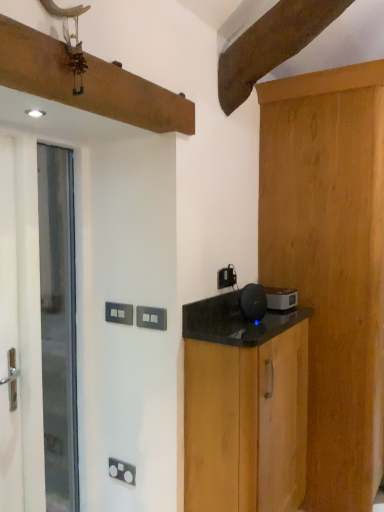
In order to face white glossy door at left, should I rotate leftwards or rightwards?

To face it directly, rotate left by 17.857 degrees.

The width and height of the screenshot is (384, 512). What do you see at coordinates (331, 263) in the screenshot?
I see `light brown wood cabinet at right, marked as the second cabinetry in a left-to-right arrangement` at bounding box center [331, 263].

Measure the distance between point [9,186] and camera.

A distance of 1.55 meters exists between point [9,186] and camera.

Measure the distance between point (x=253, y=312) and camera.

Point (x=253, y=312) is 2.08 meters from camera.

Image resolution: width=384 pixels, height=512 pixels. What do you see at coordinates (119, 313) in the screenshot? I see `white plastic switch at center, the second electric outlet from the top` at bounding box center [119, 313].

The width and height of the screenshot is (384, 512). What are the coordinates of `satin black speaker at right, positioned as the first appliance in right-to-left order` in the screenshot? It's located at (281, 298).

Where is `white glossy door at left`? white glossy door at left is located at coordinates (58, 325).

Which of these two, light brown wood cabinet at right, positioned as the 1th cabinetry in right-to-left order, or black plastic electric outlet at upper center, the 1th electric outlet from the top, stands shorter?

black plastic electric outlet at upper center, the 1th electric outlet from the top, is shorter.

From the image's perspective, is light brown wood cabinet at right, positioned as the 1th cabinetry in right-to-left order, on black plastic electric outlet at upper center, the 3th electric outlet viewed from the front?

No, from the image's perspective, light brown wood cabinet at right, positioned as the 1th cabinetry in right-to-left order, is not above black plastic electric outlet at upper center, the 3th electric outlet viewed from the front.

Would you say light brown wood cabinet at right, marked as the second cabinetry in a left-to-right arrangement, contains black plastic electric outlet at upper center, the 3th electric outlet viewed from the front?

That's incorrect, black plastic electric outlet at upper center, the 3th electric outlet viewed from the front, is not inside light brown wood cabinet at right, marked as the second cabinetry in a left-to-right arrangement.

Between light brown wood cabinet at right, positioned as the 1th cabinetry in right-to-left order, and black plastic electric outlet at upper center, the 3th electric outlet viewed from the front, which one is positioned in front?

Positioned in front is light brown wood cabinet at right, positioned as the 1th cabinetry in right-to-left order.

Does black wood cabinet at right, which is the 1th cabinetry in left-to-right order, have a smaller size compared to white matte screen door at left?

Incorrect, black wood cabinet at right, which is the 1th cabinetry in left-to-right order, is not smaller in size than white matte screen door at left.

In the scene shown: Which object is wider, black wood cabinet at right, marked as the 2th cabinetry in a right-to-left arrangement, or white matte screen door at left?

black wood cabinet at right, marked as the 2th cabinetry in a right-to-left arrangement.

Is black wood cabinet at right, which is the 1th cabinetry in left-to-right order, at the right side of white matte screen door at left?

Indeed, black wood cabinet at right, which is the 1th cabinetry in left-to-right order, is positioned on the right side of white matte screen door at left.

How much distance is there between black wood cabinet at right, which is the 1th cabinetry in left-to-right order, and white matte screen door at left?

black wood cabinet at right, which is the 1th cabinetry in left-to-right order, and white matte screen door at left are 80.73 centimeters apart from each other.

Is there a large distance between black plastic speaker at center, the 1th appliance viewed from the front, and light brown wood cabinet at right, positioned as the 1th cabinetry in right-to-left order?

black plastic speaker at center, the 1th appliance viewed from the front, is actually quite close to light brown wood cabinet at right, positioned as the 1th cabinetry in right-to-left order.

Identify the location of the 1st appliance below the light brown wood cabinet at right, marked as the second cabinetry in a left-to-right arrangement (from the image's perspective). Image resolution: width=384 pixels, height=512 pixels. (253, 302).

Which point is more distant from viewer, (241,311) or (343,453)?

Point (343,453)

Can you confirm if black plastic speaker at center, the 1th appliance viewed from the front, is bigger than light brown wood cabinet at right, positioned as the 1th cabinetry in right-to-left order?

No.

Could you tell me if white plastic switch at center, acting as the first electric outlet starting from the bottom, is facing black wood cabinet at right, which is the 1th cabinetry in left-to-right order?

No, white plastic switch at center, acting as the first electric outlet starting from the bottom, is not facing towards black wood cabinet at right, which is the 1th cabinetry in left-to-right order.

Considering the sizes of objects white plastic switch at center, acting as the 1th electric outlet starting from the front, and black wood cabinet at right, which is the 1th cabinetry in left-to-right order, in the image provided, who is wider, white plastic switch at center, acting as the 1th electric outlet starting from the front, or black wood cabinet at right, which is the 1th cabinetry in left-to-right order,?

black wood cabinet at right, which is the 1th cabinetry in left-to-right order.

Looking at the image, does white plastic switch at center, acting as the 1th electric outlet starting from the front, seem bigger or smaller compared to black wood cabinet at right, marked as the 2th cabinetry in a right-to-left arrangement?

Considering their sizes, white plastic switch at center, acting as the 1th electric outlet starting from the front, takes up less space than black wood cabinet at right, marked as the 2th cabinetry in a right-to-left arrangement.

Which is closer, (x=144, y=311) or (x=213, y=366)?

Point (x=144, y=311).

Would you consider black plastic electric outlet at upper center, the 1th electric outlet from the top, to be distant from white glossy door at left?

black plastic electric outlet at upper center, the 1th electric outlet from the top, is near white glossy door at left, not far away.

How much distance is there between black plastic electric outlet at upper center, which appears as the 3th electric outlet when viewed from the left, and white glossy door at left?

black plastic electric outlet at upper center, which appears as the 3th electric outlet when viewed from the left, is 33.30 inches away from white glossy door at left.

This screenshot has width=384, height=512. What are the coordinates of `the 3rd electric outlet positioned above the white glossy door at left (from a real-world perspective)` in the screenshot? It's located at (226, 277).

Considering the relative positions of black plastic electric outlet at upper center, marked as the 1th electric outlet in a right-to-left arrangement, and white glossy door at left in the image provided, is black plastic electric outlet at upper center, marked as the 1th electric outlet in a right-to-left arrangement, to the left or to the right of white glossy door at left?

From the image, it's evident that black plastic electric outlet at upper center, marked as the 1th electric outlet in a right-to-left arrangement, is to the right of white glossy door at left.

Does white glossy door at left contain black plastic speaker at center, the 2th appliance when ordered from back to front?

No, black plastic speaker at center, the 2th appliance when ordered from back to front, is not inside white glossy door at left.

From a real-world perspective, which is physically above, white glossy door at left or black plastic speaker at center, the second appliance from the right?

In real-world perspective, black plastic speaker at center, the second appliance from the right, is above.

From the image's perspective, is white glossy door at left below black plastic speaker at center, the second appliance from the right?

Yes.

Is white glossy door at left with black plastic speaker at center, which is counted as the 1th appliance, starting from the left?

No, white glossy door at left is not beside black plastic speaker at center, which is counted as the 1th appliance, starting from the left.

Which of these two, light brown wood cabinet at right, marked as the second cabinetry in a left-to-right arrangement, or black plastic speaker at center, the 2th appliance when ordered from back to front, stands taller?

With more height is light brown wood cabinet at right, marked as the second cabinetry in a left-to-right arrangement.

Is light brown wood cabinet at right, marked as the second cabinetry in a left-to-right arrangement, behind black plastic speaker at center, the second appliance from the right?

Yes, light brown wood cabinet at right, marked as the second cabinetry in a left-to-right arrangement, is further from the camera.

Between light brown wood cabinet at right, positioned as the 1th cabinetry in right-to-left order, and black plastic speaker at center, the 1th appliance viewed from the front, which one has smaller width?

black plastic speaker at center, the 1th appliance viewed from the front, is thinner.

You are a GUI agent. You are given a task and a screenshot of the screen. Output one action in this format:
    pyautogui.click(x=<x>, y=<y>)
    Task: Click on the 2nd cabinetry counting from the right side of the black plastic speaker at center, the 2th appliance when ordered from back to front
    
    Given the screenshot: What is the action you would take?
    pyautogui.click(x=331, y=263)

Where is `cabinetry that is the 2nd object to the right of the black plastic electric outlet at upper center, the third electric outlet from the bottom, starting at the anchor`? The image size is (384, 512). cabinetry that is the 2nd object to the right of the black plastic electric outlet at upper center, the third electric outlet from the bottom, starting at the anchor is located at coordinates (331, 263).

Image resolution: width=384 pixels, height=512 pixels. Identify the location of screen door located in front of the black wood cabinet at right, which is the 1th cabinetry in left-to-right order. (8, 256).

Considering their positions, is white glossy door at left positioned closer to black plastic electric outlet at upper center, the 3th electric outlet viewed from the front, than white plastic switch at center, acting as the first electric outlet starting from the bottom?

white plastic switch at center, acting as the first electric outlet starting from the bottom, is closer to black plastic electric outlet at upper center, the 3th electric outlet viewed from the front.

Considering their positions, is black wood cabinet at right, which is the 1th cabinetry in left-to-right order, positioned closer to light brown wood cabinet at right, positioned as the 1th cabinetry in right-to-left order, than white glossy door at left?

black wood cabinet at right, which is the 1th cabinetry in left-to-right order.

Estimate the real-world distances between objects in this image. Which object is closer to black plastic electric outlet at upper center, which appears as the 3th electric outlet when viewed from the left, white plastic switch at center, which appears as the second electric outlet when viewed from the left, or satin black speaker at right, the first appliance when ordered from back to front?

satin black speaker at right, the first appliance when ordered from back to front, is positioned closer to the anchor black plastic electric outlet at upper center, which appears as the 3th electric outlet when viewed from the left.

When comparing their distances from white plastic switch at center, the second electric outlet from the top, does black plastic speaker at center, the 1th appliance viewed from the front, or white glossy door at left seem further?

black plastic speaker at center, the 1th appliance viewed from the front.

From the image, which object appears to be nearer to white matte screen door at left, satin black speaker at right, acting as the second appliance starting from the front, or white glossy door at left?

white glossy door at left is closer to white matte screen door at left.

Estimate the real-world distances between objects in this image. Which object is further from satin black speaker at right, which ranks as the second appliance in left-to-right order, white plastic switch at center, the second electric outlet from the top, or black plastic speaker at center, which is counted as the 1th appliance, starting from the left?

The object further to satin black speaker at right, which ranks as the second appliance in left-to-right order, is white plastic switch at center, the second electric outlet from the top.

Considering their positions, is white plastic switch at center, acting as the first electric outlet starting from the bottom, positioned closer to black wood cabinet at right, which is the 1th cabinetry in left-to-right order, than black plastic electric outlet at upper center, which appears as the 3th electric outlet when viewed from the left?

Based on the image, white plastic switch at center, acting as the first electric outlet starting from the bottom, appears to be nearer to black wood cabinet at right, which is the 1th cabinetry in left-to-right order.

Which object lies nearer to the anchor point white glossy door at left, black wood cabinet at right, which is the 1th cabinetry in left-to-right order, or white plastic switch at center, which is counted as the 2th electric outlet, starting from the front?

white plastic switch at center, which is counted as the 2th electric outlet, starting from the front, is positioned closer to the anchor white glossy door at left.

Where is `appliance located between white plastic switch at center, the third electric outlet when ordered from right to left, and satin black speaker at right, positioned as the first appliance in right-to-left order, in the left-right direction`? This screenshot has width=384, height=512. appliance located between white plastic switch at center, the third electric outlet when ordered from right to left, and satin black speaker at right, positioned as the first appliance in right-to-left order, in the left-right direction is located at coordinates (253, 302).

At what (x,y) coordinates should I click in order to perform the action: click on cabinetry between white plastic switch at center, placed as the 1th electric outlet when sorted from left to right, and satin black speaker at right, acting as the second appliance starting from the front, in the horizontal direction. Please return your answer as a coordinate pair (x, y). This screenshot has width=384, height=512. Looking at the image, I should click on (246, 424).

The height and width of the screenshot is (512, 384). In order to click on appliance between black wood cabinet at right, marked as the 2th cabinetry in a right-to-left arrangement, and light brown wood cabinet at right, positioned as the 1th cabinetry in right-to-left order, in the horizontal direction in this screenshot , I will do `click(281, 298)`.

This screenshot has height=512, width=384. Identify the location of door between white matte screen door at left and black plastic speaker at center, the 2th appliance when ordered from back to front. (58, 325).